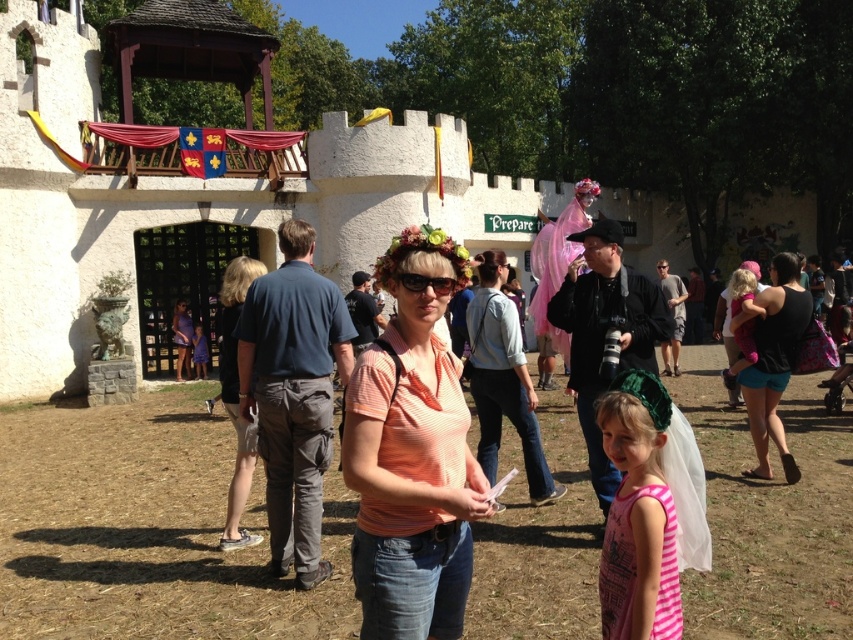
You are a photographer at the medieval event and want to take a group photo. You notice the pink striped dress at lower right and the denim shorts at center. Which of these two items is closer to the camera?

The pink striped dress at lower right is in front of denim shorts at center, meaning it is closer to the camera.

You are a photographer at the medieval event and want to take a photo of both the orange striped shirt at center and the pink striped dress at lower right. Which one should you focus on first to ensure both are in the frame?

You should focus on the orange striped shirt at center first because it is closer to you than the pink striped dress at lower right, ensuring both are in the frame.